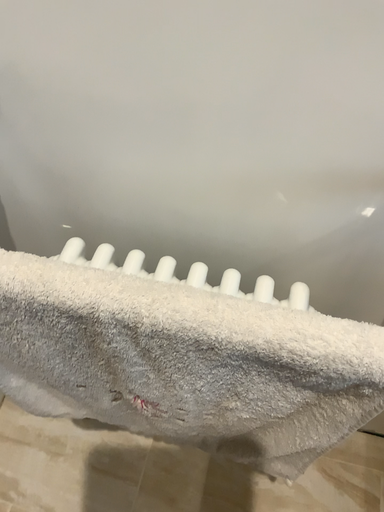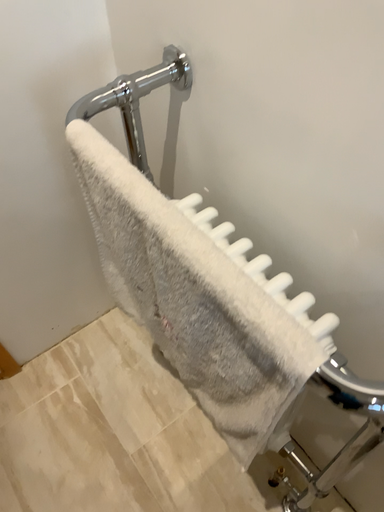
Question: How did the camera likely rotate when shooting the video?

Choices:
 (A) rotated right
 (B) rotated left

Answer: (B)